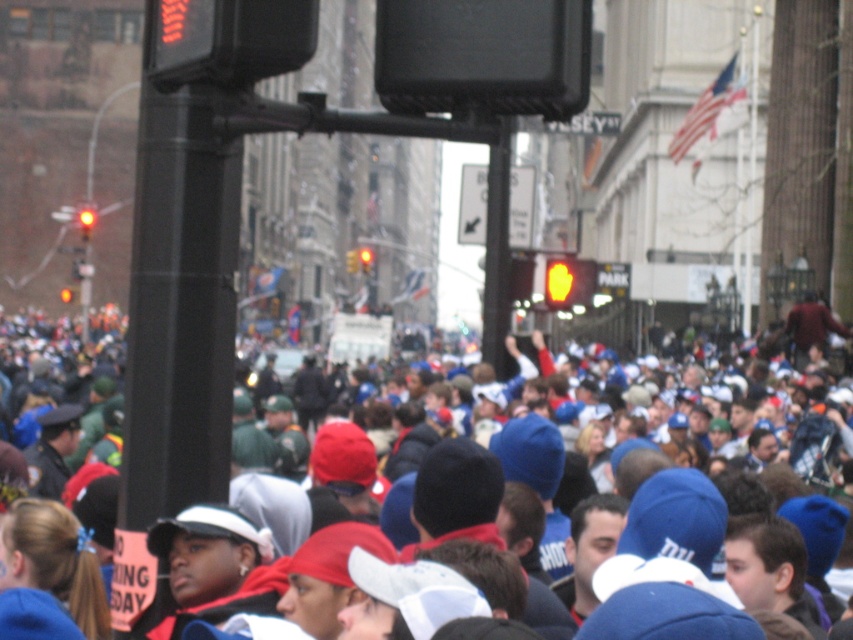
Question: Is red glass traffic light at center below amber glass traffic light at center?

Choices:
 (A) no
 (B) yes

Answer: (B)

Question: Can you confirm if yellow matte traffic light at center is positioned to the right of amber glass traffic light at center?

Choices:
 (A) no
 (B) yes

Answer: (B)

Question: Among these objects, which one is farthest from the camera?

Choices:
 (A) white paper sign at center
 (B) amber glass traffic light at center
 (C) red glass traffic light at center
 (D) yellow plastic traffic light at left

Answer: (B)

Question: Which object appears closest to the camera in this image?

Choices:
 (A) blue fabric hats at center
 (B) yellow plastic traffic light at left
 (C) red glass traffic light at center

Answer: (A)

Question: Which object is farther from the camera taking this photo?

Choices:
 (A) blue fabric hats at center
 (B) white paper sign at center

Answer: (B)

Question: Can you confirm if black metal pole at center is positioned to the left of yellow matte traffic light at center?

Choices:
 (A) yes
 (B) no

Answer: (A)